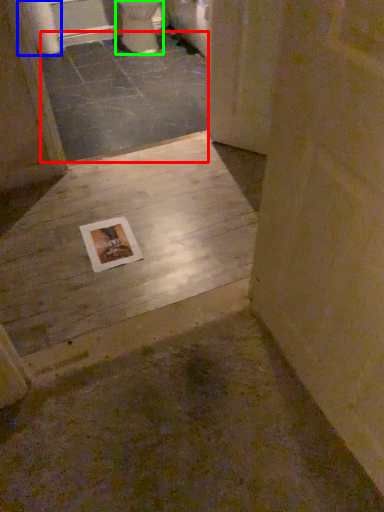
Question: Which is nearer to the concrete (highlighted by a red box)? toilet paper (highlighted by a blue box) or toilet (highlighted by a green box).

Choices:
 (A) toilet paper
 (B) toilet

Answer: (B)